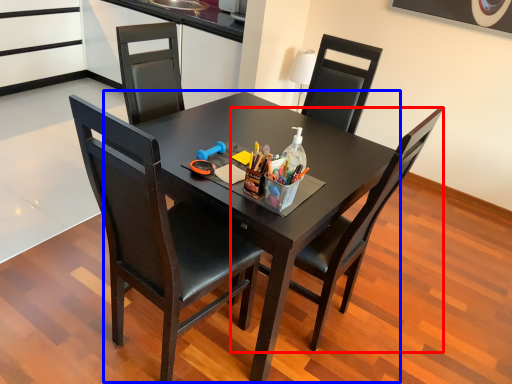
Question: Which of the following is the closest to the observer, chair (highlighted by a red box) or round table (highlighted by a blue box)?

Choices:
 (A) chair
 (B) round table

Answer: (A)